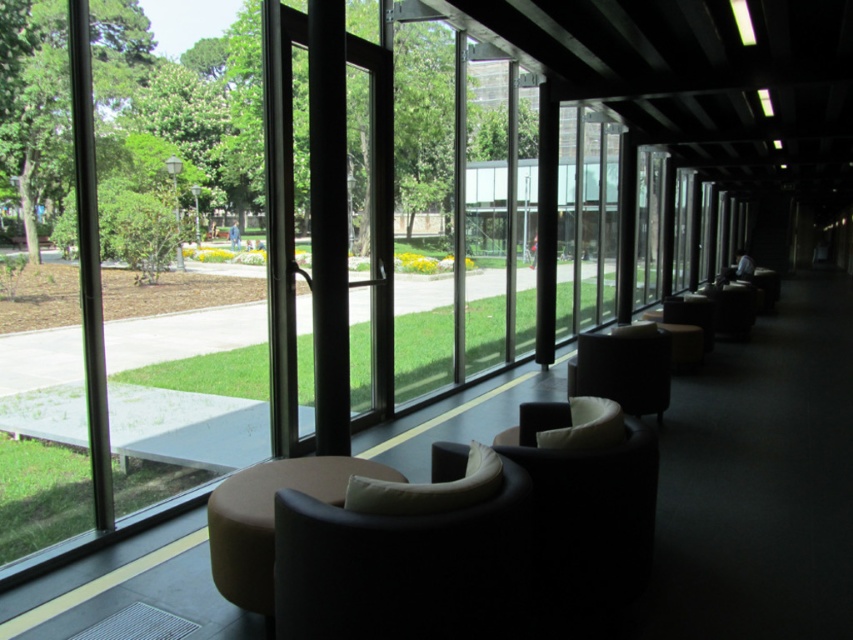
Between matte black armchair at center and matte black chair at center, which one appears on the right side from the viewer's perspective?

matte black chair at center

Does matte black armchair at center appear on the right side of matte black chair at center?

Incorrect, matte black armchair at center is not on the right side of matte black chair at center.

You are a GUI agent. You are given a task and a screenshot of the screen. Output one action in this format:
    pyautogui.click(x=<x>, y=<y>)
    Task: Click on the matte black armchair at center
    The image size is (853, 640).
    Given the screenshot: What is the action you would take?
    pyautogui.click(x=401, y=570)